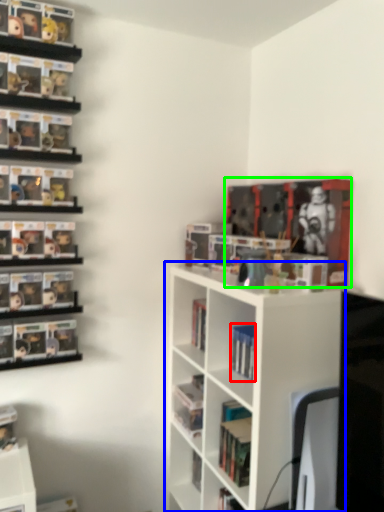
Question: Estimate the real-world distances between objects in this image. Which object is closer to book (highlighted by a red box), shelf (highlighted by a blue box) or book (highlighted by a green box)?

Choices:
 (A) shelf
 (B) book

Answer: (A)